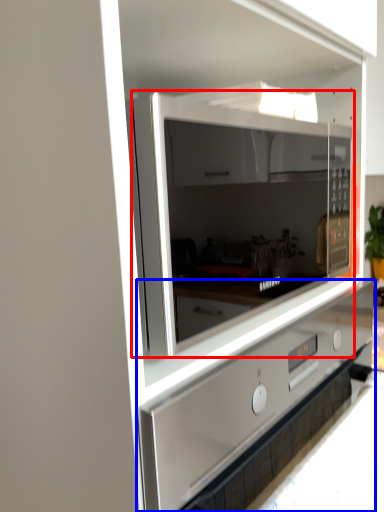
Question: Which object appears farthest to the camera in this image, microwave oven (highlighted by a red box) or home appliance (highlighted by a blue box)?

Choices:
 (A) microwave oven
 (B) home appliance

Answer: (A)